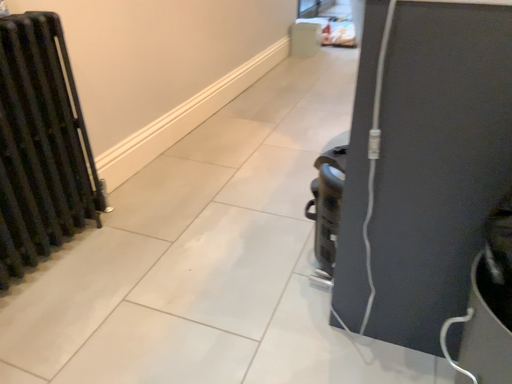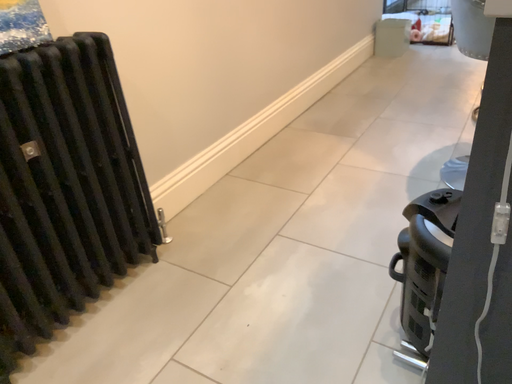
Question: How did the camera likely rotate when shooting the video?

Choices:
 (A) rotated left
 (B) rotated right

Answer: (A)